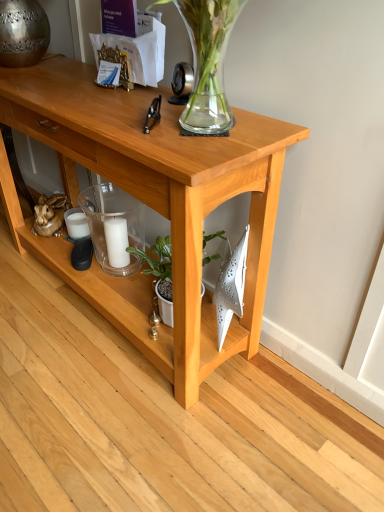
Identify the location of vacant region above light wood table at center (from a real-world perspective). (90, 94).